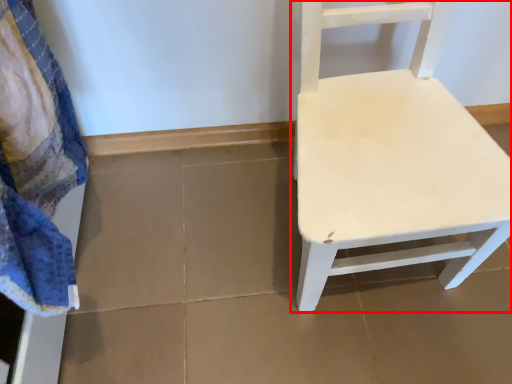
Question: Observing the image, what is the correct spatial positioning of chair (annotated by the red box) in reference to bath towel?

Choices:
 (A) left
 (B) right

Answer: (B)